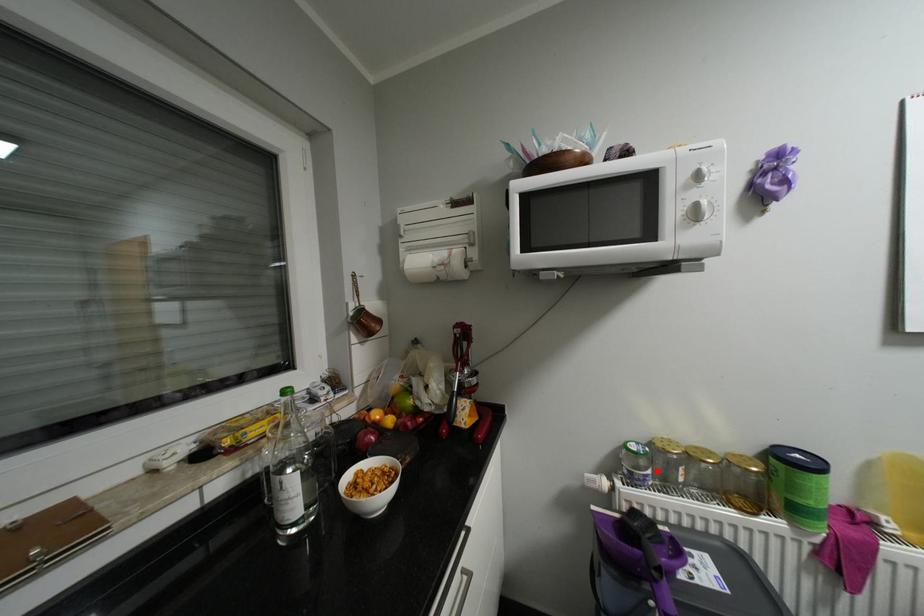
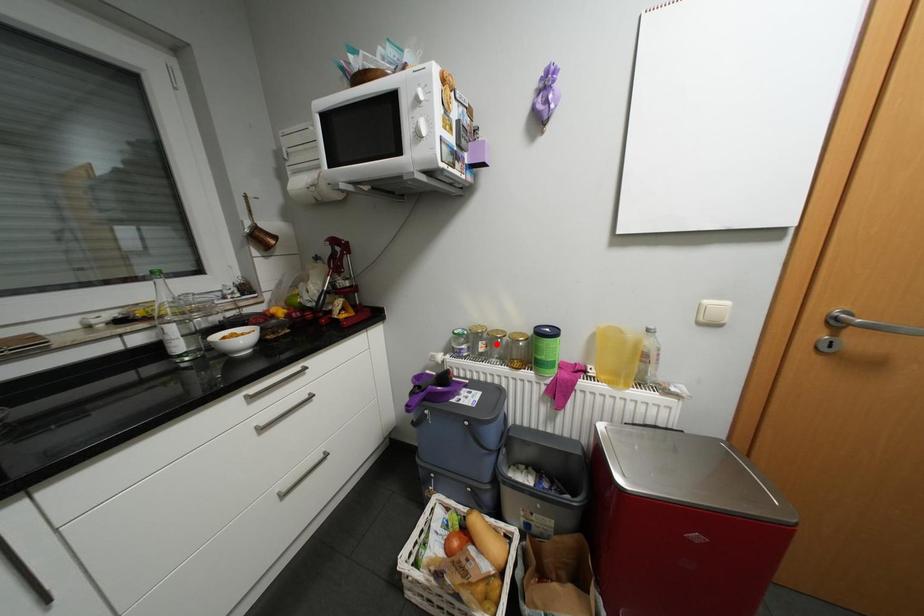
I am providing you with two images of the same scene from different viewpoints. A red point is marked on the first image and another point is marked on the second image. Do the highlighted points in image1 and image2 indicate the same real-world spot?

No